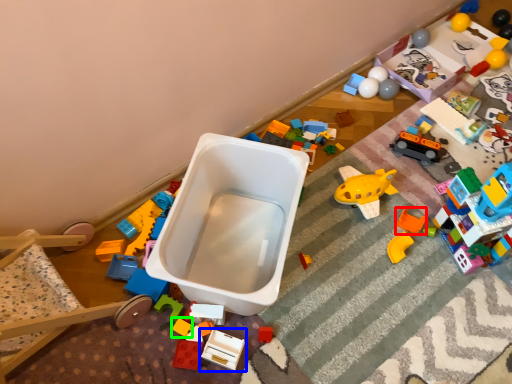
Question: Estimate the real-world distances between objects in this image. Which object is farther from toy (highlighted by a red box), toy (highlighted by a blue box) or toy (highlighted by a green box)?

Choices:
 (A) toy
 (B) toy

Answer: (B)